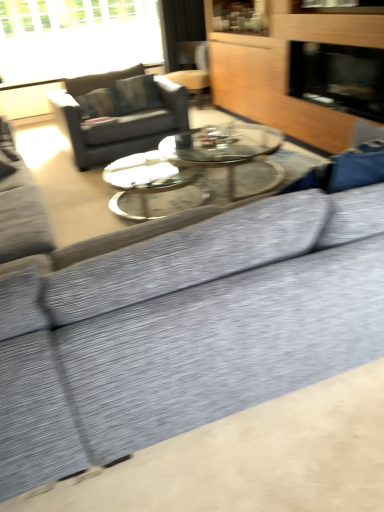
Question: In terms of size, does transparent glass window at upper left appear bigger or smaller than black glass fireplace at upper right?

Choices:
 (A) big
 (B) small

Answer: (A)

Question: From a real-world perspective, is transparent glass window at upper left positioned above or below black glass fireplace at upper right?

Choices:
 (A) above
 (B) below

Answer: (A)

Question: Which object is the closest to the transparent glass window at upper left?

Choices:
 (A) wooden dresser at upper right
 (B) wooden swivel chair at upper center
 (C) dark gray fabric couch at upper left
 (D) black glass fireplace at upper right

Answer: (B)

Question: Which object is positioned farthest from the black glass fireplace at upper right?

Choices:
 (A) wooden dresser at upper right
 (B) wooden swivel chair at upper center
 (C) transparent glass window at upper left
 (D) dark gray fabric couch at upper left

Answer: (C)